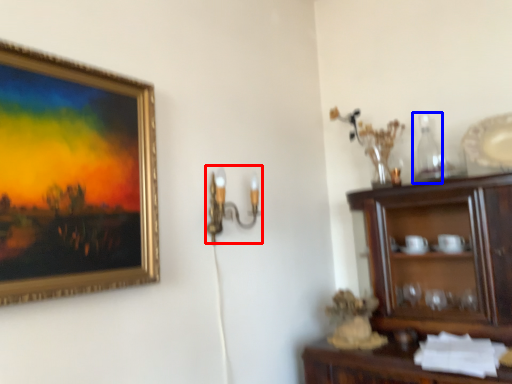
Question: Which object is further to the camera taking this photo, candle holder (highlighted by a red box) or bottle (highlighted by a blue box)?

Choices:
 (A) candle holder
 (B) bottle

Answer: (B)